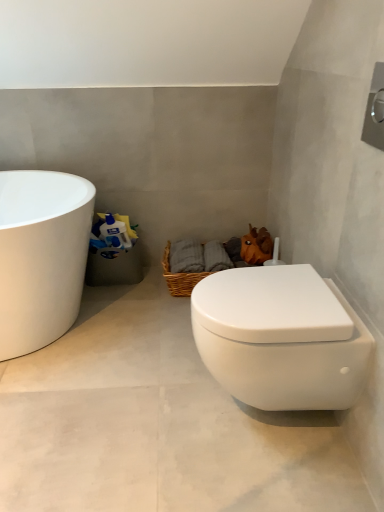
Question: Considering the positions of point (163, 473) and point (269, 252), is point (163, 473) closer or farther from the camera than point (269, 252)?

Choices:
 (A) farther
 (B) closer

Answer: (B)

Question: From the image's perspective, relative to orange matte plush toy at upper right, is white matte toilet at lower right above or below?

Choices:
 (A) above
 (B) below

Answer: (B)

Question: Which of these objects is positioned closest to the white matte toilet at lower right?

Choices:
 (A) woven brown basket at center
 (B) white glossy toilet at lower right
 (C) orange matte plush toy at upper right

Answer: (B)

Question: Which is farther from the woven brown basket at center?

Choices:
 (A) orange matte plush toy at upper right
 (B) white glossy toilet at lower right
 (C) white matte toilet at lower right

Answer: (B)